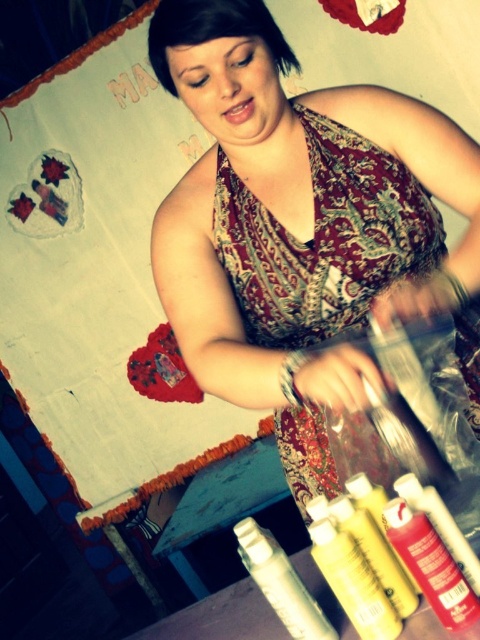
Question: Which point is farther from the camera taking this photo?

Choices:
 (A) (245, 544)
 (B) (379, 531)
 (C) (296, 307)
 (D) (327, 568)

Answer: (C)

Question: Is yellow matte paint at lower center thinner than yellow matte paint bottle at lower center?

Choices:
 (A) no
 (B) yes

Answer: (B)

Question: Which point appears closest to the camera in this image?

Choices:
 (A) (352, 529)
 (B) (279, 566)

Answer: (A)

Question: Does matte red spray can at lower right have a smaller size compared to yellow matte bottle at center?

Choices:
 (A) no
 (B) yes

Answer: (B)

Question: Can you confirm if matte floral dress at center is bigger than yellow matte paint bottle at lower center?

Choices:
 (A) yes
 (B) no

Answer: (A)

Question: Among these points, which one is farthest from the camera?

Choices:
 (A) (260, 561)
 (B) (365, 563)
 (C) (352, 522)

Answer: (C)